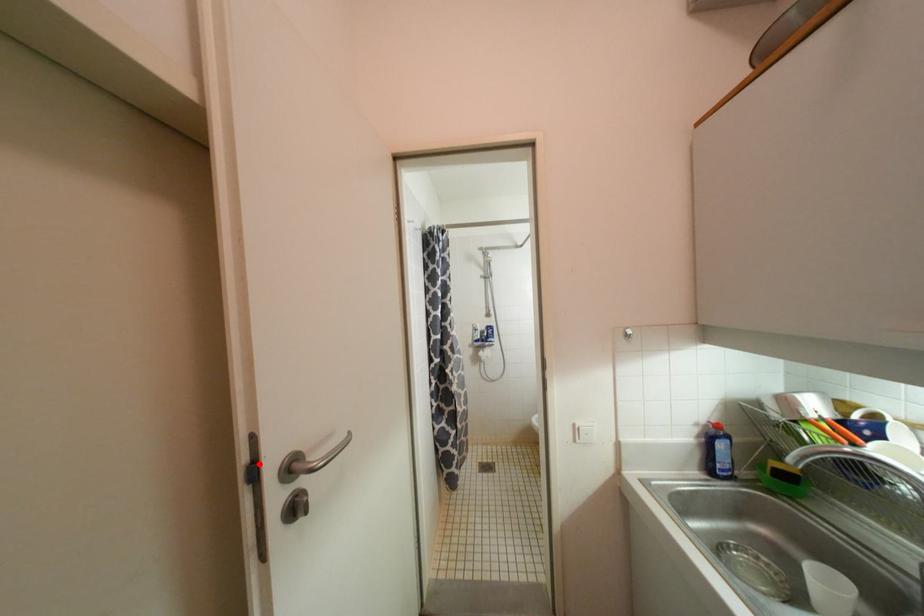
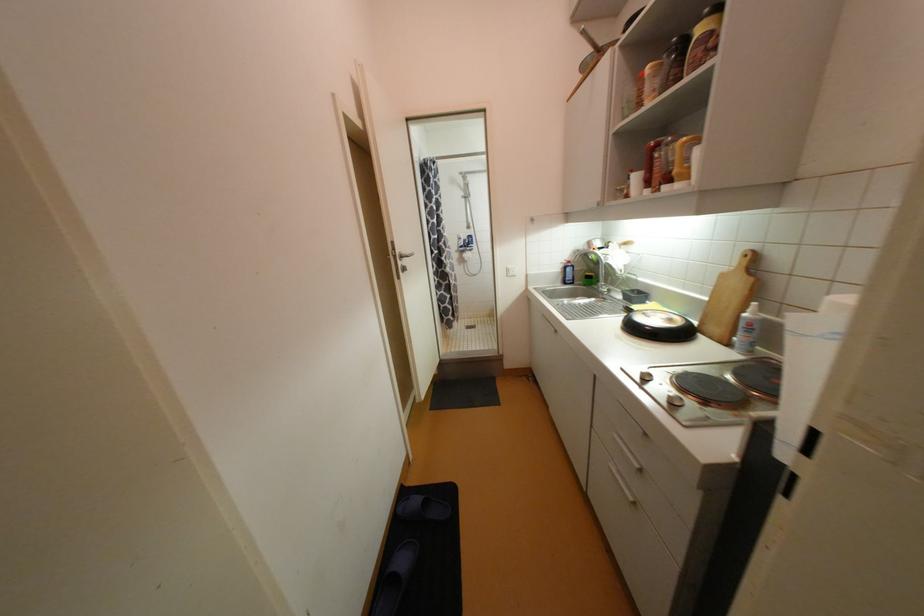
Where in the second image is the point corresponding to the highlighted location from the first image?

(398, 251)